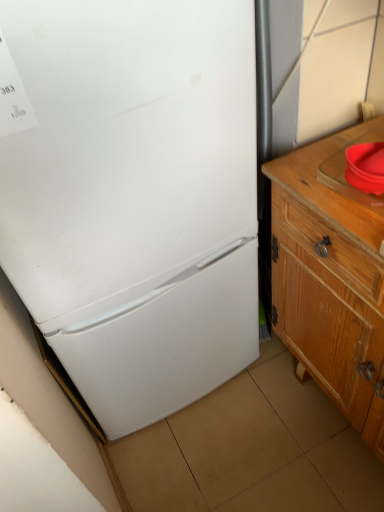
Question: Does white matte refrigerator at left appear on the left side of wooden cabinet at right?

Choices:
 (A) no
 (B) yes

Answer: (B)

Question: Is white matte refrigerator at left located outside wooden cabinet at right?

Choices:
 (A) no
 (B) yes

Answer: (B)

Question: From the image's perspective, is white matte refrigerator at left under wooden cabinet at right?

Choices:
 (A) no
 (B) yes

Answer: (A)

Question: Is white matte refrigerator at left turned away from wooden cabinet at right?

Choices:
 (A) no
 (B) yes

Answer: (A)

Question: From a real-world perspective, is white matte refrigerator at left beneath wooden cabinet at right?

Choices:
 (A) no
 (B) yes

Answer: (A)

Question: In terms of width, does red plastic sink at right look wider or thinner when compared to white matte refrigerator at left?

Choices:
 (A) wide
 (B) thin

Answer: (B)

Question: Relative to white matte refrigerator at left, is red plastic sink at right in front or behind?

Choices:
 (A) front
 (B) behind

Answer: (B)

Question: Considering the positions of red plastic sink at right and white matte refrigerator at left in the image, is red plastic sink at right taller or shorter than white matte refrigerator at left?

Choices:
 (A) tall
 (B) short

Answer: (B)

Question: From the image's perspective, is red plastic sink at right located above or below white matte refrigerator at left?

Choices:
 (A) above
 (B) below

Answer: (A)

Question: Is point (377, 202) positioned closer to the camera than point (365, 226)?

Choices:
 (A) farther
 (B) closer

Answer: (A)

Question: In terms of height, does red plastic sink at right look taller or shorter compared to wooden cabinet at right?

Choices:
 (A) tall
 (B) short

Answer: (B)

Question: Is red plastic sink at right in front of or behind wooden cabinet at right in the image?

Choices:
 (A) front
 (B) behind

Answer: (B)

Question: Do you think red plastic sink at right is within wooden cabinet at right, or outside of it?

Choices:
 (A) inside
 (B) outside

Answer: (B)

Question: Is wooden cabinet at right taller or shorter than white matte refrigerator at left?

Choices:
 (A) short
 (B) tall

Answer: (A)

Question: In the image, is wooden cabinet at right positioned in front of or behind white matte refrigerator at left?

Choices:
 (A) behind
 (B) front

Answer: (A)